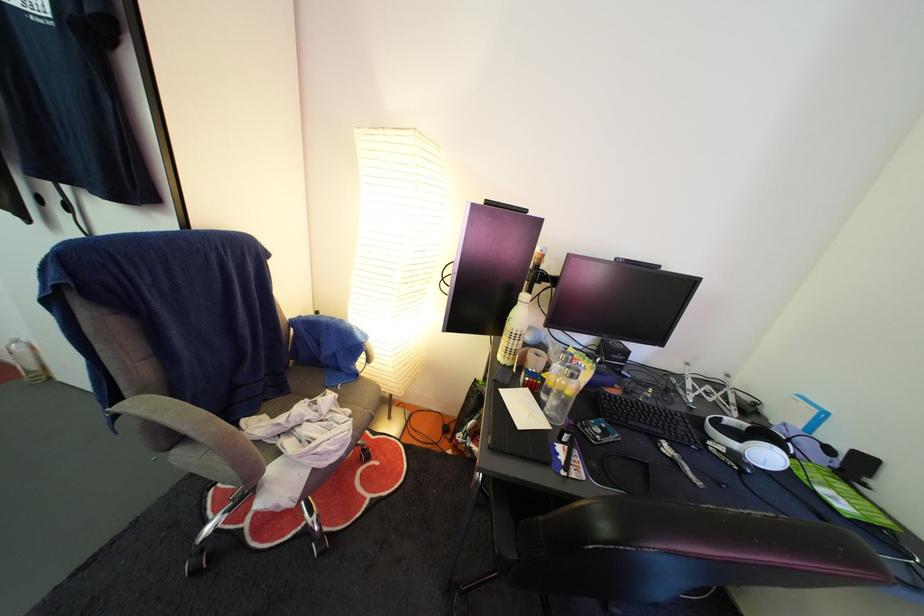
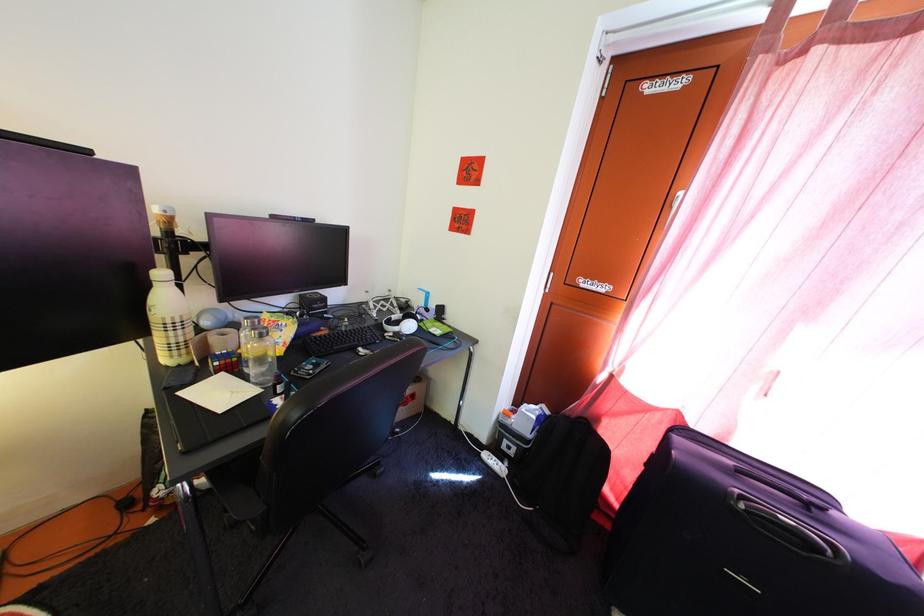
In the second image, find the point that corresponds to the point at 578,376 in the first image.

(262, 338)